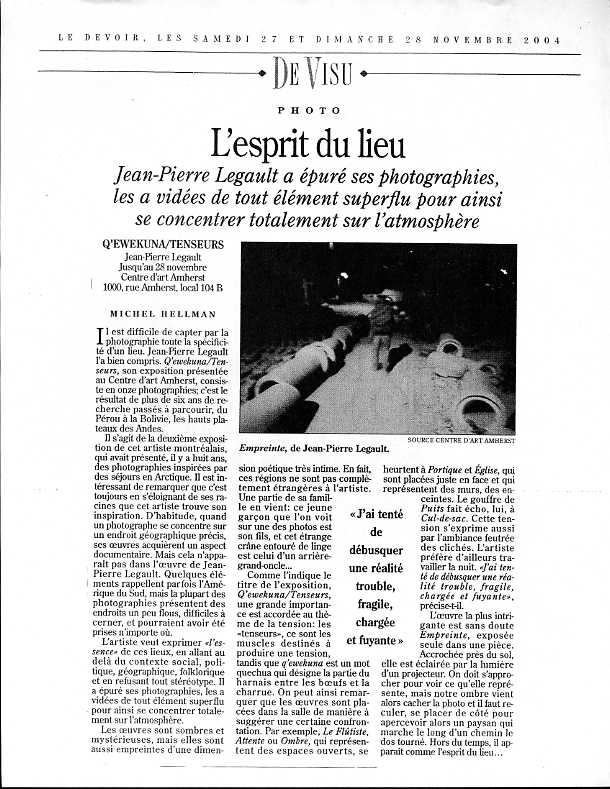
Image resolution: width=610 pixels, height=789 pixels. Identify the location of picture. (400, 417).